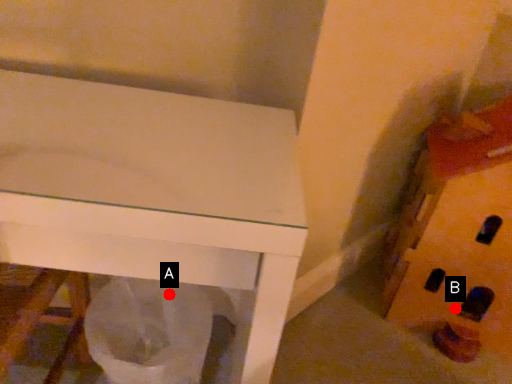
Question: Two points are circled on the image, labeled by A and B beside each circle. Which point is closer to the camera?

Choices:
 (A) A is closer
 (B) B is closer

Answer: (A)